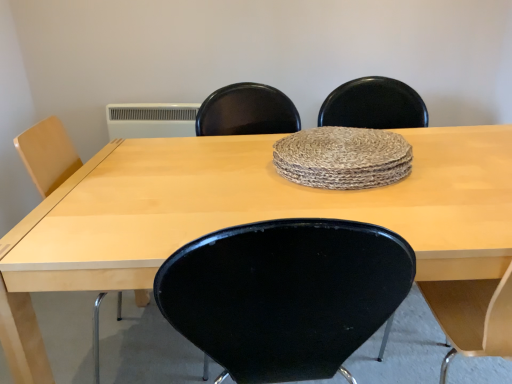
Find the location of a particular element. free location to the left of natural fiber placemat at center is located at coordinates (210, 175).